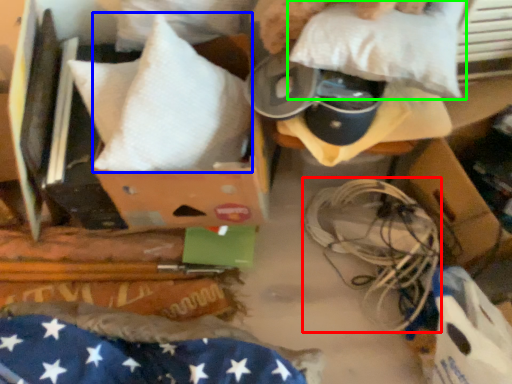
Question: Which object is the closest to the wire (highlighted by a red box)? Choose among these: pillow (highlighted by a blue box) or pillow (highlighted by a green box).

Choices:
 (A) pillow
 (B) pillow

Answer: (B)